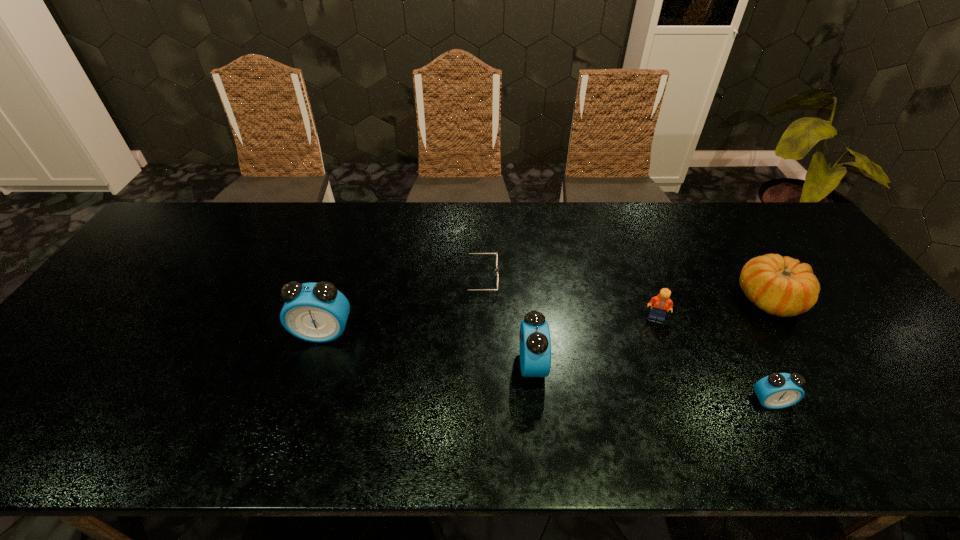
Where is `unoccupied position between the rightmost object and the second shortest alarm clock`? unoccupied position between the rightmost object and the second shortest alarm clock is located at coordinates (651, 333).

What are the coordinates of `empty space between the second alarm clock from left to right and the leftmost alarm clock` in the screenshot? It's located at (428, 349).

Where is `free space that is in between the shortest object and the rightmost alarm clock`? free space that is in between the shortest object and the rightmost alarm clock is located at coordinates [621, 340].

Where is `empty space that is in between the leftmost object and the Lego`? The image size is (960, 540). empty space that is in between the leftmost object and the Lego is located at coordinates (490, 325).

Find the location of a particular element. The width and height of the screenshot is (960, 540). free spot between the fifth object from left to right and the Lego is located at coordinates (713, 359).

Locate an element on the screen. The height and width of the screenshot is (540, 960). vacant point located between the Lego and the fifth object from left to right is located at coordinates (713, 359).

The image size is (960, 540). Identify the location of empty space that is in between the Lego and the fifth shortest object. (594, 341).

This screenshot has height=540, width=960. I want to click on empty location between the second alarm clock from left to right and the leftmost object, so click(428, 349).

Locate an element on the screen. This screenshot has width=960, height=540. free space between the gourd and the leftmost alarm clock is located at coordinates (547, 316).

This screenshot has height=540, width=960. Identify the location of vacant point located between the gourd and the shortest object. (621, 289).